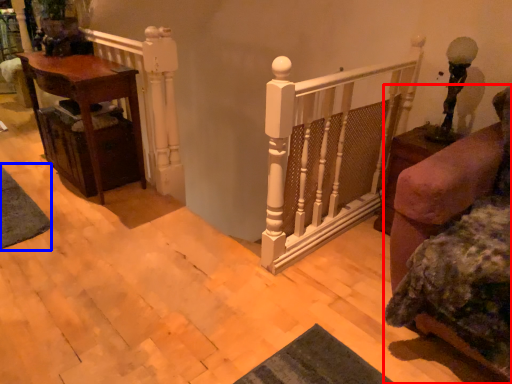
Question: Which of the following is the farthest to the observer, furniture (highlighted by a red box) or mat (highlighted by a blue box)?

Choices:
 (A) furniture
 (B) mat

Answer: (B)